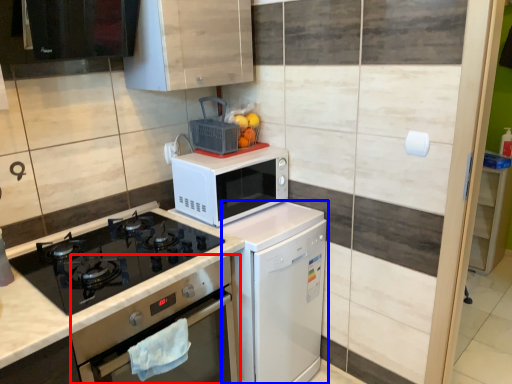
Question: Which point is further to the camera, oven (highlighted by a red box) or dish washer (highlighted by a blue box)?

Choices:
 (A) oven
 (B) dish washer

Answer: (B)